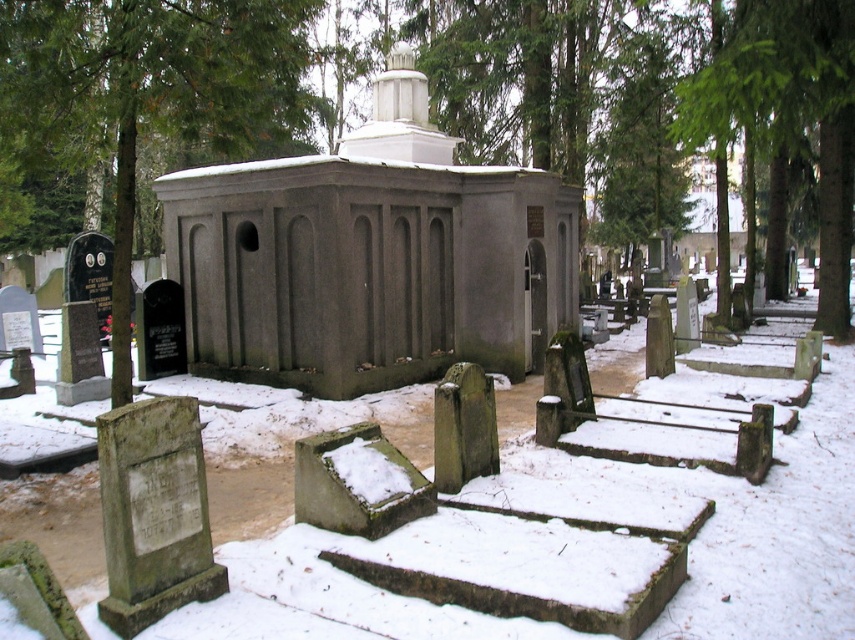
You are standing at the entrance of the cemetery and want to locate the gray concrete church at center. According to the coordinate system where the bottom left corner is the origin, can you determine its exact position?

The gray concrete church at center is located at the coordinate point of 0.403 on the x axis and 0.435 on the y axis.

You are standing at the entrance of the gray concrete church at center and want to walk towards the green textured tree at left. Which direction should you face to move towards the tree?

You should face to the left direction to move towards the green textured tree at left from the gray concrete church at center since the gray concrete church at center is positioned under the tree, implying the tree is to the left side of the church.

You are standing in the cemetery and want to take a photo of the green textured tree at left. If your camera can focus on objects up to 6 meters away, will it be able to capture the tree clearly?

The green textured tree at left is 6.13 meters away from the viewer. Since the camera can focus up to 6 meters, it cannot capture the tree clearly as it is slightly beyond the maximum focus range.